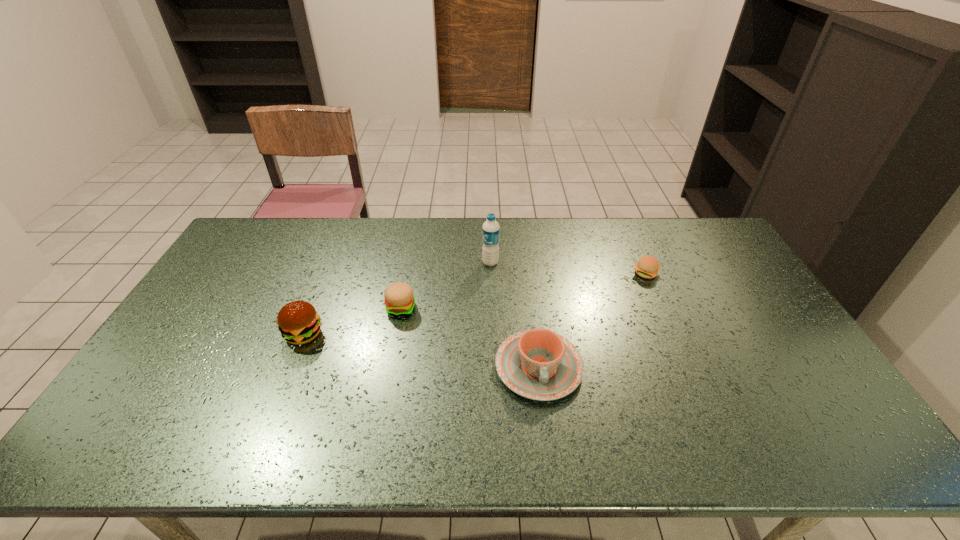
The width and height of the screenshot is (960, 540). In order to click on free space between the tallest object and the rightmost object in this screenshot , I will do `click(568, 268)`.

Locate an element on the screen. unoccupied position between the rightmost object and the chinaware is located at coordinates (592, 320).

What are the coordinates of `empty space that is in between the rightmost object and the chinaware` in the screenshot? It's located at (592, 320).

At what (x,y) coordinates should I click in order to perform the action: click on vacant area that lies between the chinaware and the rightmost hamburger. Please return your answer as a coordinate pair (x, y). The width and height of the screenshot is (960, 540). Looking at the image, I should click on (592, 320).

At what (x,y) coordinates should I click in order to perform the action: click on vacant space that is in between the second hamburger from left to right and the farthest hamburger. Please return your answer as a coordinate pair (x, y). The image size is (960, 540). Looking at the image, I should click on (523, 291).

At what (x,y) coordinates should I click in order to perform the action: click on unoccupied area between the tallest hamburger and the shortest hamburger. Please return your answer as a coordinate pair (x, y). This screenshot has width=960, height=540. Looking at the image, I should click on (474, 303).

Find the location of a particular element. The height and width of the screenshot is (540, 960). free space between the second nearest hamburger and the tallest hamburger is located at coordinates (352, 321).

Select which object is the closest to the chinaware. Please provide its 2D coordinates. Your answer should be formatted as a tuple, i.e. [(x, y)], where the tuple contains the x and y coordinates of a point satisfying the conditions above.

[(399, 300)]

Choose which object is the nearest neighbor to the leftmost object. Please provide its 2D coordinates. Your answer should be formatted as a tuple, i.e. [(x, y)], where the tuple contains the x and y coordinates of a point satisfying the conditions above.

[(399, 300)]

Find the location of a particular element. This screenshot has height=540, width=960. hamburger that is the closest to the nearest hamburger is located at coordinates point(399,300).